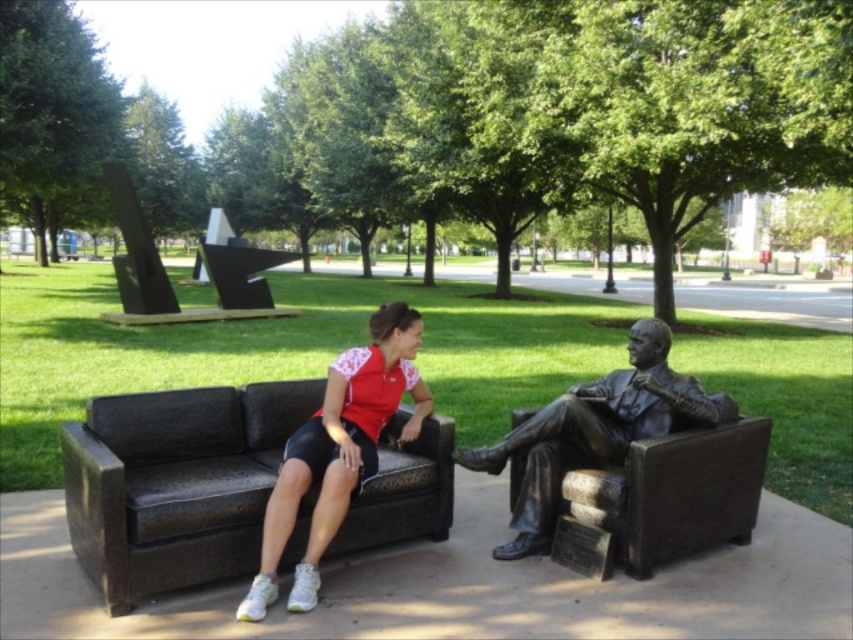
Question: Can you confirm if bronze/statue at right is wider than matte red shirt at center?

Choices:
 (A) no
 (B) yes

Answer: (B)

Question: Which of these objects is positioned farthest from the bronze/statue at right?

Choices:
 (A) matte red shirt at center
 (B) bronze statue at right

Answer: (A)

Question: Which point is closer to the camera taking this photo?

Choices:
 (A) (659, 392)
 (B) (288, 390)
 (C) (752, 492)
 (D) (415, 426)

Answer: (A)

Question: Which of the following is the farthest from the observer?

Choices:
 (A) (177, 406)
 (B) (712, 419)

Answer: (A)

Question: Can you confirm if bronze/statue at right is positioned above bronze statue at right?

Choices:
 (A) no
 (B) yes

Answer: (A)

Question: Does bronze/statue at right have a larger size compared to bronze statue at right?

Choices:
 (A) yes
 (B) no

Answer: (B)